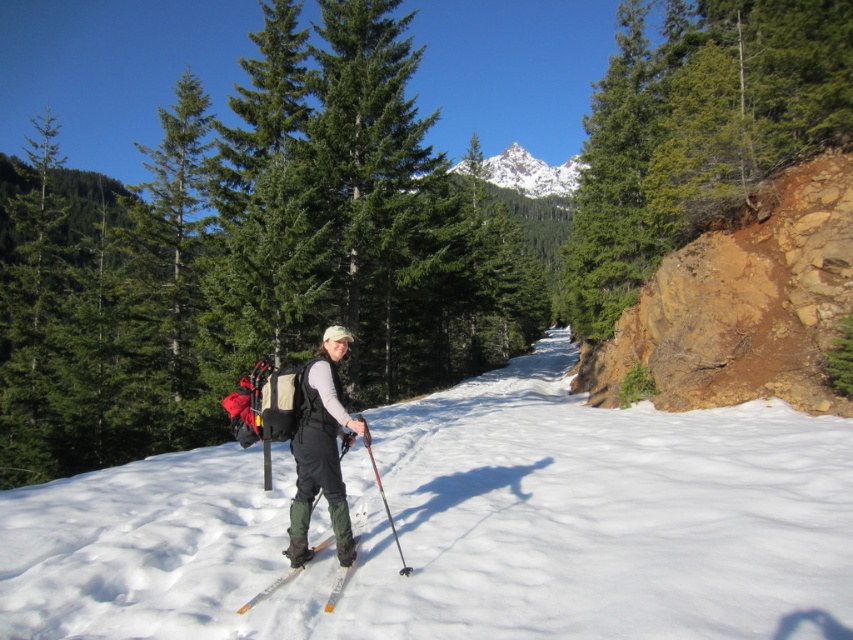
Who is positioned more to the left, white snow at center or red metallic ski pole at center?

From the viewer's perspective, red metallic ski pole at center appears more on the left side.

Which is above, white snow at center or red metallic ski pole at center?

red metallic ski pole at center is above.

Which is behind, point (672, 593) or point (387, 512)?

Point (387, 512)

Where is `white snow at center`? Image resolution: width=853 pixels, height=640 pixels. white snow at center is located at coordinates (463, 525).

Which of these two, green matte tree at center or red metallic ski pole at center, stands taller?

green matte tree at center

Who is lower down, green matte tree at center or red metallic ski pole at center?

Positioned lower is red metallic ski pole at center.

Who is more forward, [49,269] or [393,538]?

Positioned in front is point [393,538].

Locate an element on the screen. green matte tree at center is located at coordinates (252, 253).

Can you confirm if green matte tree at center is shorter than snowy white peak at upper center?

No, green matte tree at center is not shorter than snowy white peak at upper center.

Which is below, green matte tree at center or snowy white peak at upper center?

snowy white peak at upper center is lower down.

Describe the element at coordinates (252, 253) in the screenshot. This screenshot has height=640, width=853. I see `green matte tree at center` at that location.

You are a GUI agent. You are given a task and a screenshot of the screen. Output one action in this format:
    pyautogui.click(x=<x>, y=<y>)
    Task: Click on the green matte tree at center
    
    Given the screenshot: What is the action you would take?
    pyautogui.click(x=252, y=253)